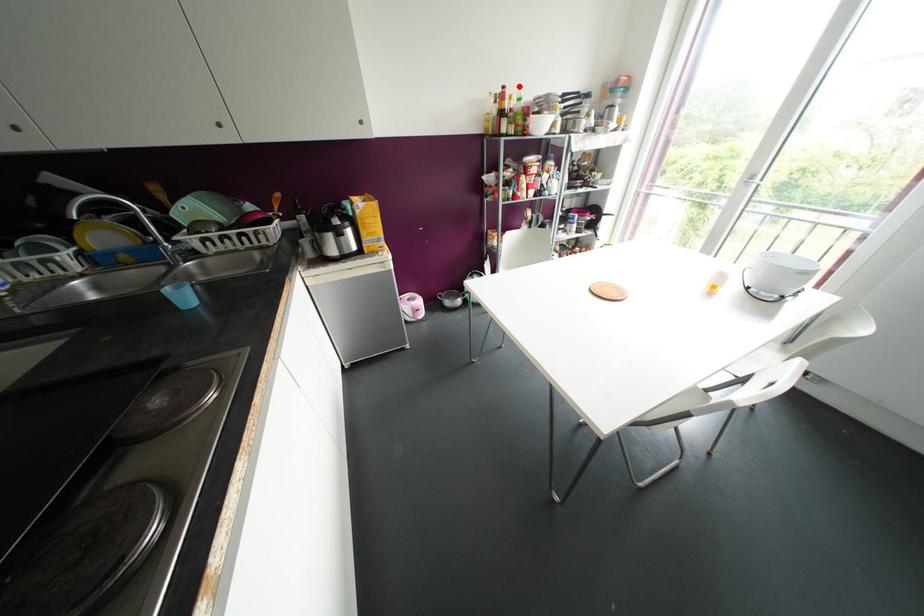
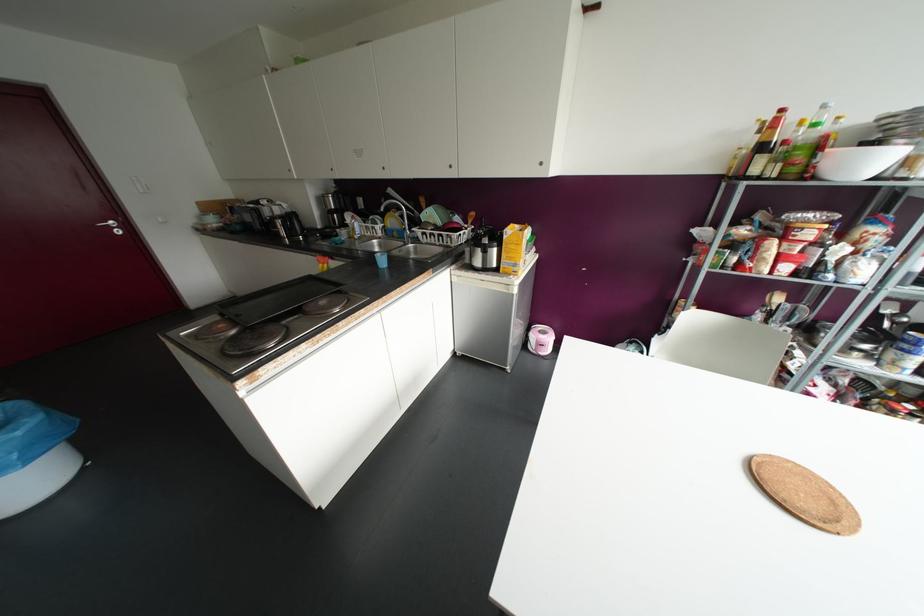
Question: I am providing you with two images of the same scene from different viewpoints. A red point is shown in image1. For the corresponding object point in image2, is it positioned nearer or farther from the camera?

Choices:
 (A) Nearer
 (B) Farther

Answer: (B)